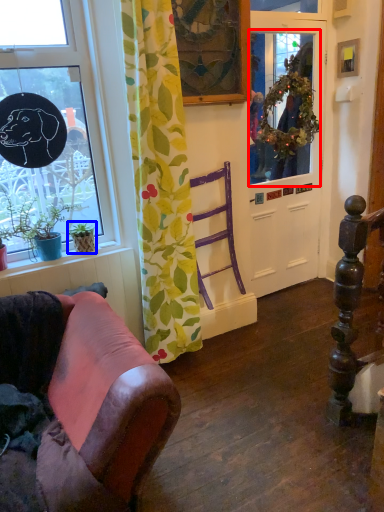
Question: Which object appears farthest to the camera in this image, window screen (highlighted by a red box) or houseplant (highlighted by a blue box)?

Choices:
 (A) window screen
 (B) houseplant

Answer: (A)